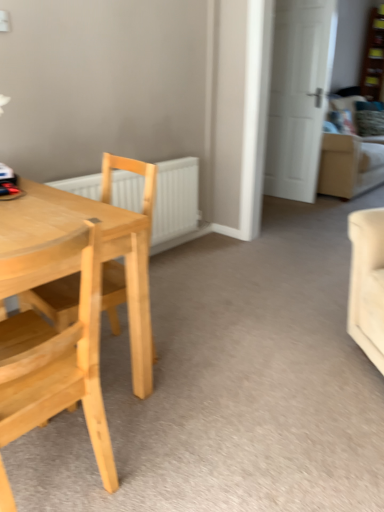
Where is `vacant area located to the right-hand side of light wood chair at left, the second chair viewed from the back`? The width and height of the screenshot is (384, 512). vacant area located to the right-hand side of light wood chair at left, the second chair viewed from the back is located at coordinates point(180,449).